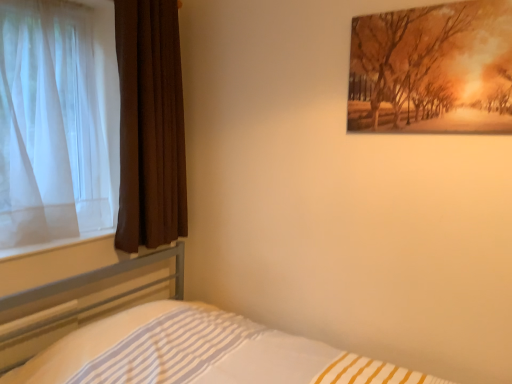
Locate an element on the screen. brown velvet curtain at left, which ranks as the second curtain in left-to-right order is located at coordinates (150, 125).

This screenshot has height=384, width=512. What are the coordinates of `brown velvet curtain at left, the 1th curtain positioned from the right` in the screenshot? It's located at (150, 125).

Locate an element on the screen. Image resolution: width=512 pixels, height=384 pixels. picture frame that is above the white sheer curtain at left, the 1th curtain when ordered from left to right (from a real-world perspective) is located at coordinates 433,69.

From the image's perspective, is white sheer curtain at left, the 1th curtain when ordered from left to right, on matte orange painting at upper right?

Incorrect, from the image's perspective, white sheer curtain at left, the 1th curtain when ordered from left to right, is lower than matte orange painting at upper right.

Looking at this image, is white sheer curtain at left, which is counted as the 2th curtain, starting from the right, facing away from matte orange painting at upper right?

No, white sheer curtain at left, which is counted as the 2th curtain, starting from the right,'s orientation is not away from matte orange painting at upper right.

This screenshot has width=512, height=384. I want to click on curtain behind the white sheer curtain at left, the 1th curtain when ordered from left to right, so click(150, 125).

Is brown velvet curtain at left, which ranks as the second curtain in left-to-right order, to the right of white sheer curtain at left, which is counted as the 2th curtain, starting from the right, from the viewer's perspective?

Indeed, brown velvet curtain at left, which ranks as the second curtain in left-to-right order, is positioned on the right side of white sheer curtain at left, which is counted as the 2th curtain, starting from the right.

Consider the image. Which of these two, brown velvet curtain at left, the 1th curtain positioned from the right, or white sheer curtain at left, which is counted as the 2th curtain, starting from the right, stands taller?

brown velvet curtain at left, the 1th curtain positioned from the right.

How different are the orientations of white sheer curtain at left, which is counted as the 2th curtain, starting from the right, and brown velvet curtain at left, which ranks as the second curtain in left-to-right order, in degrees?

They differ by 0.358 degrees in their facing directions.

From a real-world perspective, is white sheer curtain at left, which is counted as the 2th curtain, starting from the right, on top of brown velvet curtain at left, the 1th curtain positioned from the right?

Correct, in the physical world, white sheer curtain at left, which is counted as the 2th curtain, starting from the right, is higher than brown velvet curtain at left, the 1th curtain positioned from the right.

From the image's perspective, between white sheer curtain at left, the 1th curtain when ordered from left to right, and brown velvet curtain at left, the 1th curtain positioned from the right, which one is located above?

brown velvet curtain at left, the 1th curtain positioned from the right, is shown above in the image.

This screenshot has width=512, height=384. In the image, there is a white sheer curtain at left, the 1th curtain when ordered from left to right. Find the location of `curtain above it (from the image's perspective)`. curtain above it (from the image's perspective) is located at coordinates (150, 125).

Does point (399, 116) come behind point (142, 240)?

No, (399, 116) is in front of (142, 240).

Which of these two, matte orange painting at upper right or brown velvet curtain at left, which ranks as the second curtain in left-to-right order, is thinner?

Thinner between the two is matte orange painting at upper right.

Which is correct: matte orange painting at upper right is inside brown velvet curtain at left, the 1th curtain positioned from the right, or outside of it?

matte orange painting at upper right exists outside the volume of brown velvet curtain at left, the 1th curtain positioned from the right.

Can you confirm if white striped fabric at lower left is smaller than white sheer curtain at left, which is counted as the 2th curtain, starting from the right?

Actually, white striped fabric at lower left might be larger than white sheer curtain at left, which is counted as the 2th curtain, starting from the right.

Looking at this image, from a real-world perspective, which object rests below the other?

white striped fabric at lower left is physically lower.

Considering the relative positions of white striped fabric at lower left and white sheer curtain at left, which is counted as the 2th curtain, starting from the right, in the image provided, is white striped fabric at lower left to the left or to the right of white sheer curtain at left, which is counted as the 2th curtain, starting from the right,?

white striped fabric at lower left is to the right of white sheer curtain at left, which is counted as the 2th curtain, starting from the right.

Is white sheer curtain at left, the 1th curtain when ordered from left to right, at the back of white striped fabric at lower left?

That's not correct — white striped fabric at lower left is not looking away from white sheer curtain at left, the 1th curtain when ordered from left to right.

Would you say matte orange painting at upper right is inside or outside white sheer curtain at left, which is counted as the 2th curtain, starting from the right?

matte orange painting at upper right lies outside white sheer curtain at left, which is counted as the 2th curtain, starting from the right.

From the image's perspective, is matte orange painting at upper right below white sheer curtain at left, the 1th curtain when ordered from left to right?

No, from the image's perspective, matte orange painting at upper right is not below white sheer curtain at left, the 1th curtain when ordered from left to right.

Is matte orange painting at upper right facing away from white sheer curtain at left, the 1th curtain when ordered from left to right?

That's not correct — matte orange painting at upper right is not looking away from white sheer curtain at left, the 1th curtain when ordered from left to right.

From a real-world perspective, between white sheer curtain at left, which is counted as the 2th curtain, starting from the right, and white striped fabric at lower left, who is vertically lower?

white striped fabric at lower left.

Is white sheer curtain at left, which is counted as the 2th curtain, starting from the right, looking in the opposite direction of white striped fabric at lower left?

No, white sheer curtain at left, which is counted as the 2th curtain, starting from the right, is not facing the opposite direction of white striped fabric at lower left.

Considering the sizes of objects white sheer curtain at left, which is counted as the 2th curtain, starting from the right, and white striped fabric at lower left in the image provided, who is wider, white sheer curtain at left, which is counted as the 2th curtain, starting from the right, or white striped fabric at lower left?

With larger width is white striped fabric at lower left.

Can you confirm if white sheer curtain at left, the 1th curtain when ordered from left to right, is taller than white striped fabric at lower left?

Yes.

Find the location of `picture frame located above the white sheer curtain at left, which is counted as the 2th curtain, starting from the right (from a real-world perspective)`. picture frame located above the white sheer curtain at left, which is counted as the 2th curtain, starting from the right (from a real-world perspective) is located at coordinates click(x=433, y=69).

Locate an element on the screen. The image size is (512, 384). curtain above the white sheer curtain at left, which is counted as the 2th curtain, starting from the right (from the image's perspective) is located at coordinates (150, 125).

When comparing their distances from brown velvet curtain at left, which ranks as the second curtain in left-to-right order, does white striped fabric at lower left or white sheer curtain at left, which is counted as the 2th curtain, starting from the right, seem closer?

white sheer curtain at left, which is counted as the 2th curtain, starting from the right, is closer to brown velvet curtain at left, which ranks as the second curtain in left-to-right order.

Estimate the real-world distances between objects in this image. Which object is closer to brown velvet curtain at left, the 1th curtain positioned from the right, matte orange painting at upper right or white sheer curtain at left, the 1th curtain when ordered from left to right?

white sheer curtain at left, the 1th curtain when ordered from left to right, is closer to brown velvet curtain at left, the 1th curtain positioned from the right.

Based on their spatial positions, is white sheer curtain at left, which is counted as the 2th curtain, starting from the right, or brown velvet curtain at left, which ranks as the second curtain in left-to-right order, further from matte orange painting at upper right?

white sheer curtain at left, which is counted as the 2th curtain, starting from the right.

When comparing their distances from matte orange painting at upper right, does white striped fabric at lower left or white sheer curtain at left, which is counted as the 2th curtain, starting from the right, seem closer?

white striped fabric at lower left lies closer to matte orange painting at upper right than the other object.

Considering their positions, is white striped fabric at lower left positioned further to white sheer curtain at left, the 1th curtain when ordered from left to right, than matte orange painting at upper right?

matte orange painting at upper right is further to white sheer curtain at left, the 1th curtain when ordered from left to right.

Based on their spatial positions, is matte orange painting at upper right or white striped fabric at lower left closer to brown velvet curtain at left, which ranks as the second curtain in left-to-right order?

white striped fabric at lower left lies closer to brown velvet curtain at left, which ranks as the second curtain in left-to-right order, than the other object.

Considering their positions, is white sheer curtain at left, which is counted as the 2th curtain, starting from the right, positioned further to matte orange painting at upper right than white striped fabric at lower left?

white sheer curtain at left, which is counted as the 2th curtain, starting from the right, lies further to matte orange painting at upper right than the other object.

Based on their spatial positions, is brown velvet curtain at left, which ranks as the second curtain in left-to-right order, or matte orange painting at upper right closer to white sheer curtain at left, which is counted as the 2th curtain, starting from the right?

brown velvet curtain at left, which ranks as the second curtain in left-to-right order, is positioned closer to the anchor white sheer curtain at left, which is counted as the 2th curtain, starting from the right.

You are a GUI agent. You are given a task and a screenshot of the screen. Output one action in this format:
    pyautogui.click(x=<x>, y=<y>)
    Task: Click on the curtain located between white striped fabric at lower left and brown velvet curtain at left, which ranks as the second curtain in left-to-right order, in the depth direction
    
    Given the screenshot: What is the action you would take?
    pyautogui.click(x=55, y=122)

The image size is (512, 384). Identify the location of curtain situated between white sheer curtain at left, the 1th curtain when ordered from left to right, and matte orange painting at upper right from left to right. pyautogui.click(x=150, y=125).

You are a GUI agent. You are given a task and a screenshot of the screen. Output one action in this format:
    pyautogui.click(x=<x>, y=<y>)
    Task: Click on the bed between white sheer curtain at left, which is counted as the 2th curtain, starting from the right, and matte orange painting at upper right from left to right
    The image size is (512, 384).
    Given the screenshot: What is the action you would take?
    pyautogui.click(x=164, y=340)